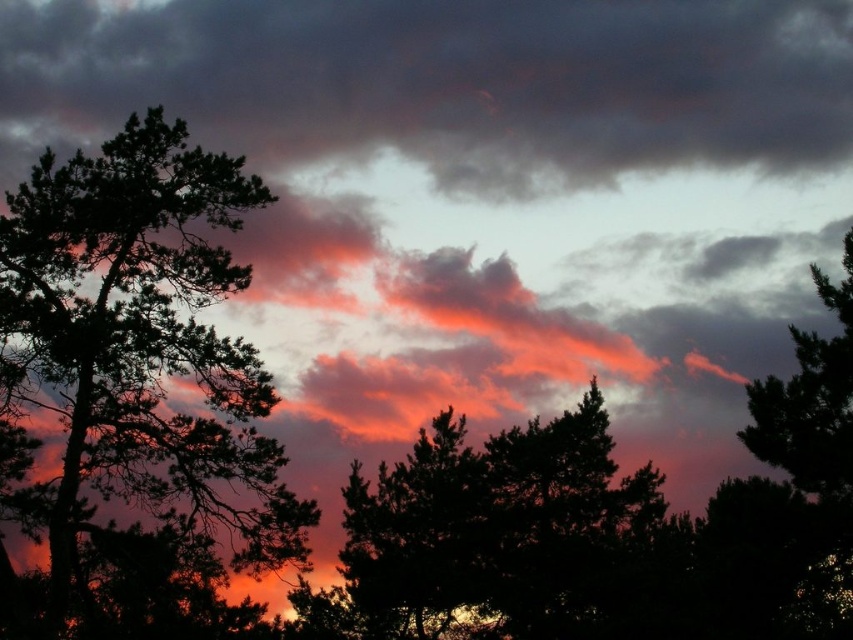
Consider the image. You are standing in the field and want to take a photo of the dark gray cloud at upper center and the silhouette tree at left. The camera you have can focus on objects up to 10 meters away. Can you capture both in focus without moving?

The dark gray cloud at upper center is 8.16 meters away from the silhouette tree at left. Since the camera can focus up to 10 meters, both objects are within the focusing range and can be captured in focus without moving.